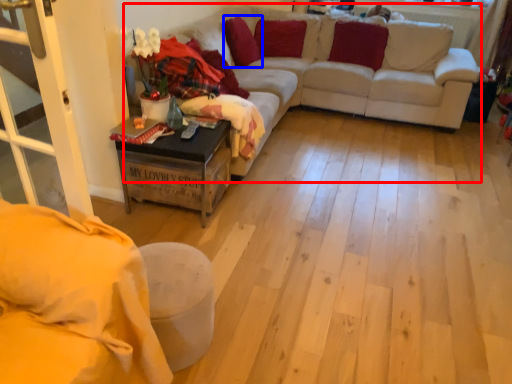
Question: Which of the following is the farthest to the observer, couch (highlighted by a red box) or pillow (highlighted by a blue box)?

Choices:
 (A) couch
 (B) pillow

Answer: (B)